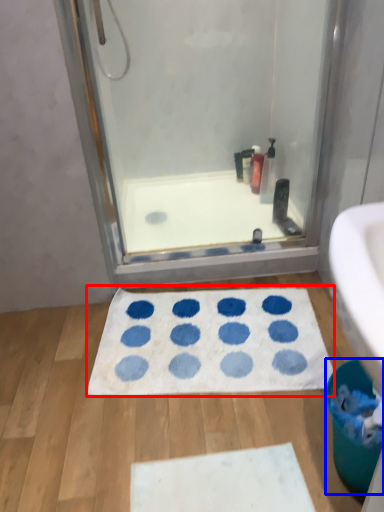
Question: Which object is further to the camera taking this photo, bath mat (highlighted by a red box) or toilet bowl (highlighted by a blue box)?

Choices:
 (A) bath mat
 (B) toilet bowl

Answer: (A)